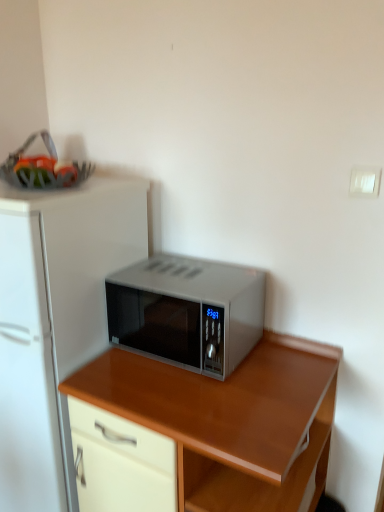
Identify the location of satin silver microwave at center. This screenshot has height=512, width=384. (187, 312).

Image resolution: width=384 pixels, height=512 pixels. Find the location of `satin silver microwave at center`. satin silver microwave at center is located at coordinates (187, 312).

You are a GUI agent. You are given a task and a screenshot of the screen. Output one action in this format:
    pyautogui.click(x=<x>, y=<y>)
    Task: Click on the desk that is on the right side of white matte refrigerator at center
    This screenshot has width=384, height=512.
    Given the screenshot: What is the action you would take?
    pos(229,420)

What's the angular difference between white matte refrigerator at center and wooden desk at center's facing directions?

There is a 1.79-degree angle between the facing directions of white matte refrigerator at center and wooden desk at center.

Considering the sizes of objects white matte refrigerator at center and wooden desk at center in the image provided, who is bigger, white matte refrigerator at center or wooden desk at center?

Bigger between the two is white matte refrigerator at center.

Is wooden desk at center inside white matte refrigerator at center?

No, wooden desk at center is not inside white matte refrigerator at center.

Considering the relative sizes of satin silver microwave at center and white matte refrigerator at center in the image provided, is satin silver microwave at center shorter than white matte refrigerator at center?

Indeed, satin silver microwave at center has a lesser height compared to white matte refrigerator at center.

Is point (214, 362) positioned behind point (18, 240)?

That is True.

Is satin silver microwave at center inside the boundaries of white matte refrigerator at center, or outside?

satin silver microwave at center is not inside white matte refrigerator at center, it's outside.

Considering the positions of point (4, 426) and point (229, 331), is point (4, 426) closer or farther from the camera than point (229, 331)?

Point (4, 426) appears to be farther away from the viewer than point (229, 331).

Does white matte refrigerator at center appear on the left side of satin silver microwave at center?

Yes, white matte refrigerator at center is to the left of satin silver microwave at center.

Which of these two, white matte refrigerator at center or satin silver microwave at center, stands taller?

With more height is white matte refrigerator at center.

Can you confirm if wooden desk at center is positioned to the left of satin silver microwave at center?

No.

You are a GUI agent. You are given a task and a screenshot of the screen. Output one action in this format:
    pyautogui.click(x=<x>, y=<y>)
    Task: Click on the desk on the right of satin silver microwave at center
    
    Given the screenshot: What is the action you would take?
    coord(229,420)

Which is behind, wooden desk at center or satin silver microwave at center?

satin silver microwave at center is more distant.

From the image's perspective, is wooden desk at center under white matte refrigerator at center?

Yes, from the image's perspective, wooden desk at center is beneath white matte refrigerator at center.

Is wooden desk at center in contact with white matte refrigerator at center?

No, wooden desk at center is not in contact with white matte refrigerator at center.

Consider the image. Is wooden desk at center facing away from white matte refrigerator at center?

No, wooden desk at center is not facing the opposite direction of white matte refrigerator at center.

Can you confirm if satin silver microwave at center is thinner than wooden desk at center?

Yes, satin silver microwave at center is thinner than wooden desk at center.

Considering the relative sizes of satin silver microwave at center and wooden desk at center in the image provided, is satin silver microwave at center smaller than wooden desk at center?

Yes, satin silver microwave at center is smaller than wooden desk at center.

Is satin silver microwave at center facing towards wooden desk at center?

No, satin silver microwave at center is not facing towards wooden desk at center.

Does point (191, 324) come in front of point (93, 401)?

No, (191, 324) is further to viewer.

Identify the location of refrigerator above the wooden desk at center (from a real-world perspective). (55, 321).

Locate an element on the screen. This screenshot has height=512, width=384. refrigerator located below the satin silver microwave at center (from the image's perspective) is located at coordinates (55, 321).

From the image, which object appears to be nearer to white matte refrigerator at center, satin silver microwave at center or wooden desk at center?

satin silver microwave at center.

When comparing their distances from satin silver microwave at center, does wooden desk at center or white matte refrigerator at center seem closer?

wooden desk at center.

From the image, which object appears to be farther from wooden desk at center, white matte refrigerator at center or satin silver microwave at center?

Based on the image, white matte refrigerator at center appears to be further to wooden desk at center.

Which object lies nearer to the anchor point satin silver microwave at center, white matte refrigerator at center or wooden desk at center?

wooden desk at center is closer to satin silver microwave at center.

Looking at the image, which one is located further to white matte refrigerator at center, wooden desk at center or satin silver microwave at center?

Among the two, wooden desk at center is located further to white matte refrigerator at center.

Based on the photo, estimate the real-world distances between objects in this image. Which object is closer to wooden desk at center, satin silver microwave at center or white matte refrigerator at center?

satin silver microwave at center.

Locate an element on the screen. This screenshot has width=384, height=512. microwave oven located between white matte refrigerator at center and wooden desk at center in the left-right direction is located at coordinates (187, 312).